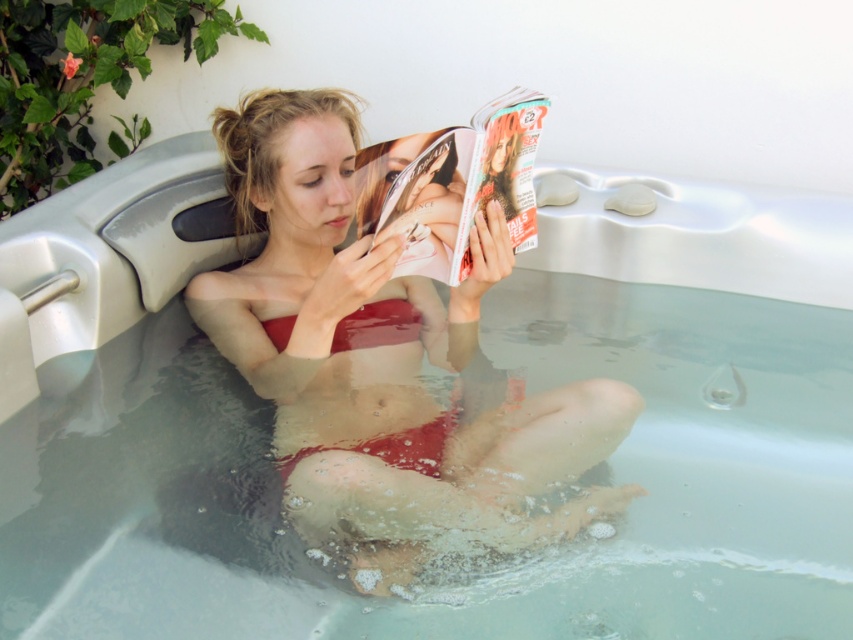
Question: Which of the following is the closest to the observer?

Choices:
 (A) (351, 312)
 (B) (427, 202)
 (C) (399, 509)

Answer: (C)

Question: Which object is the closest to the matte red bikini top at center?

Choices:
 (A) matte glossy magazine at center
 (B) matte red bikini at center

Answer: (B)

Question: Observing the image, what is the correct spatial positioning of matte red bikini at center in reference to matte glossy magazine at center?

Choices:
 (A) left
 (B) right

Answer: (A)

Question: Can you confirm if matte red bikini at center is positioned to the left of matte red bikini top at center?

Choices:
 (A) no
 (B) yes

Answer: (A)

Question: Is matte glossy magazine at center smaller than matte red bikini top at center?

Choices:
 (A) no
 (B) yes

Answer: (A)

Question: Which is farther from the matte red bikini top at center?

Choices:
 (A) matte glossy magazine at center
 (B) matte red bikini at center

Answer: (A)